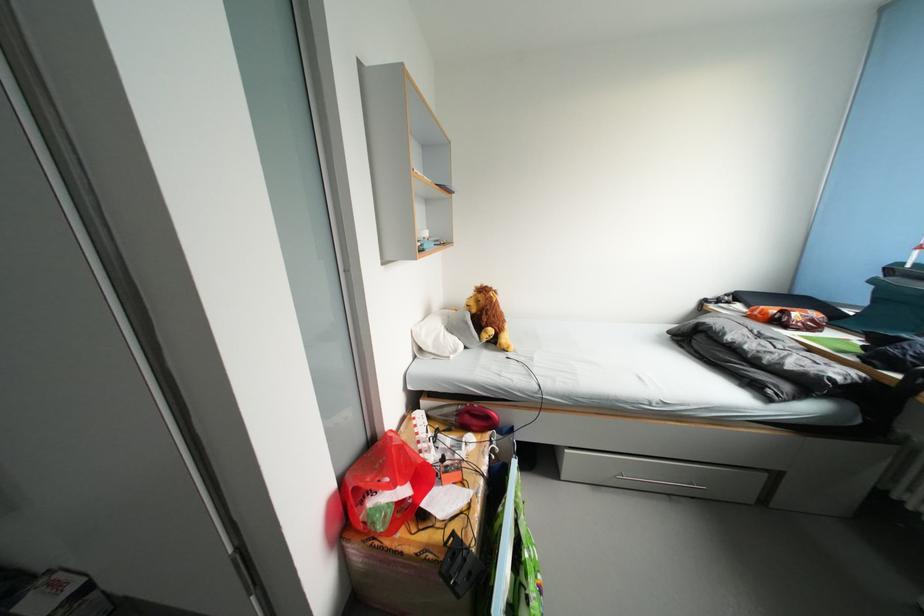
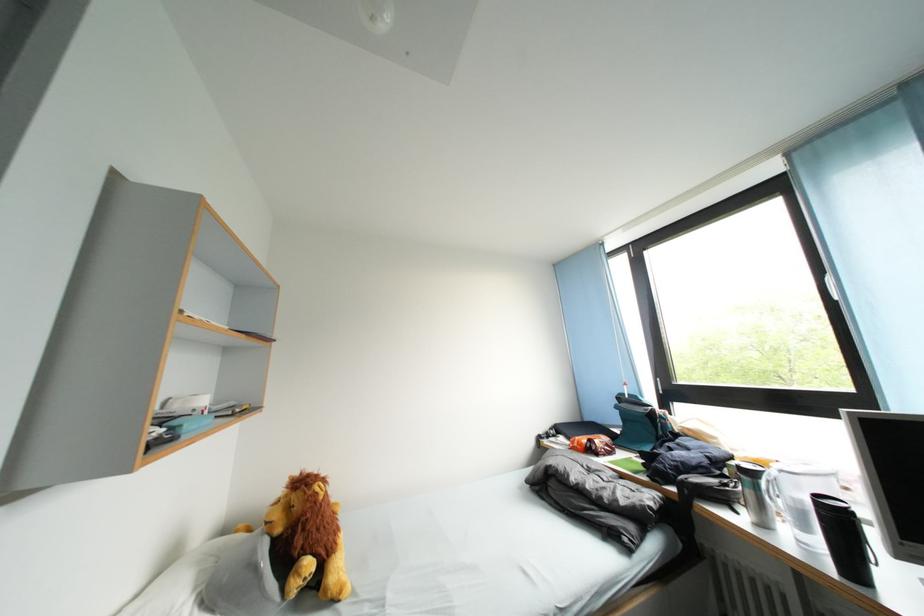
Consider the image. The images are taken continuously from a first-person perspective. In which direction is your viewpoint rotating?

The camera rotated toward right-up.